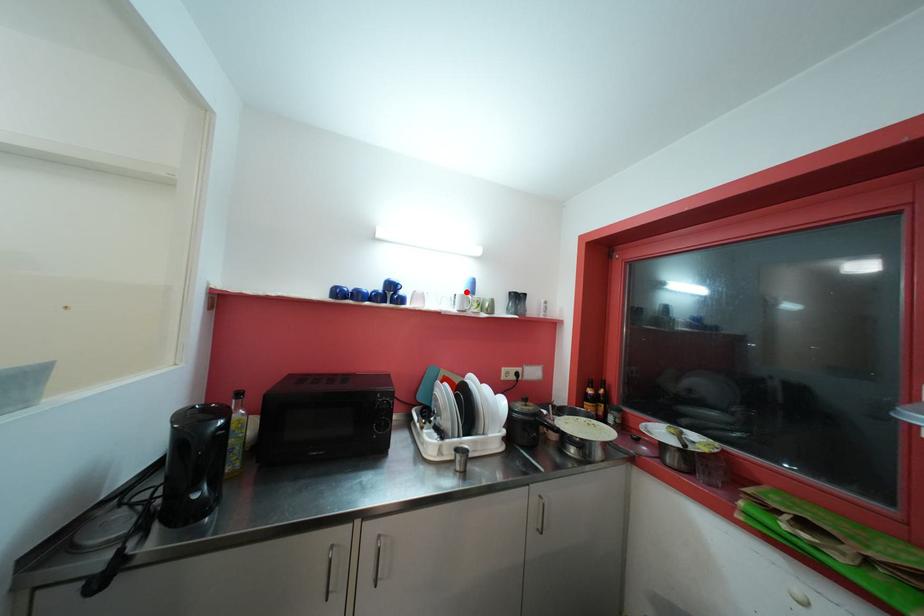
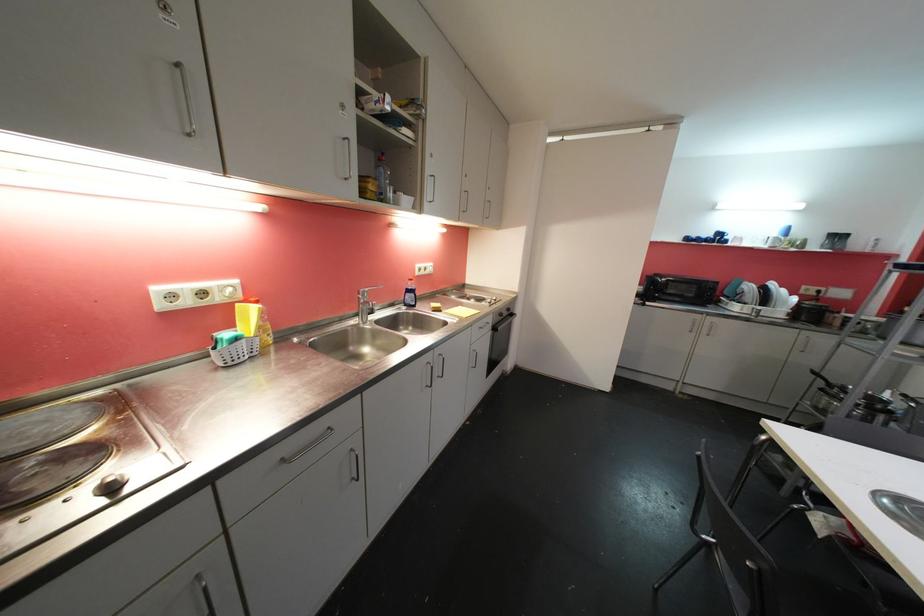
Question: I am providing you with two images of the same scene from different viewpoints. A red point is marked on the first image. Can you still see the location of the red point in image 2?

Choices:
 (A) Yes
 (B) No

Answer: (A)